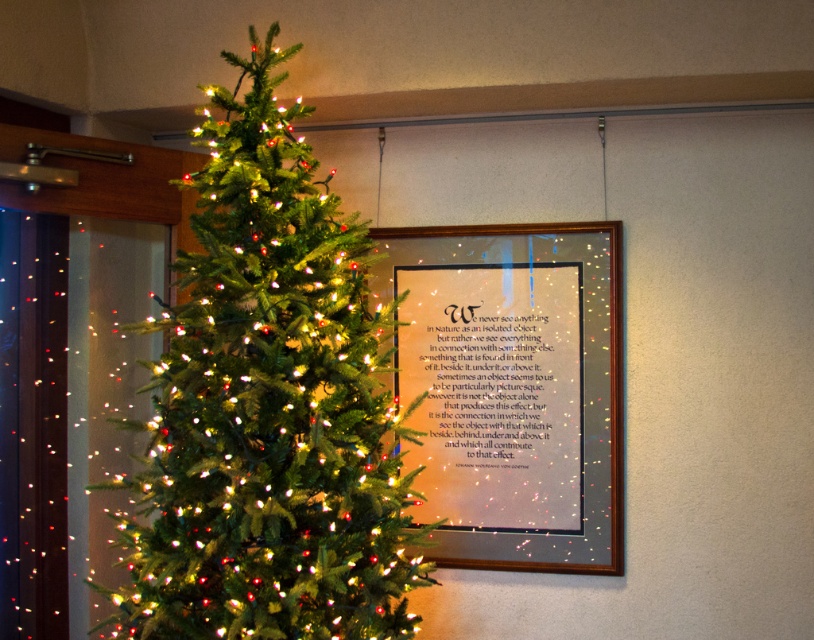
Does green matte christmas tree at center have a larger size compared to matte silver frame at center?

Yes, green matte christmas tree at center is bigger than matte silver frame at center.

From the picture: Does green matte christmas tree at center appear over matte silver frame at center?

Indeed, green matte christmas tree at center is positioned over matte silver frame at center.

Is point (133, 573) positioned after point (484, 506)?

No, (133, 573) is in front of (484, 506).

Locate an element on the screen. This screenshot has width=814, height=640. green matte christmas tree at center is located at coordinates (270, 406).